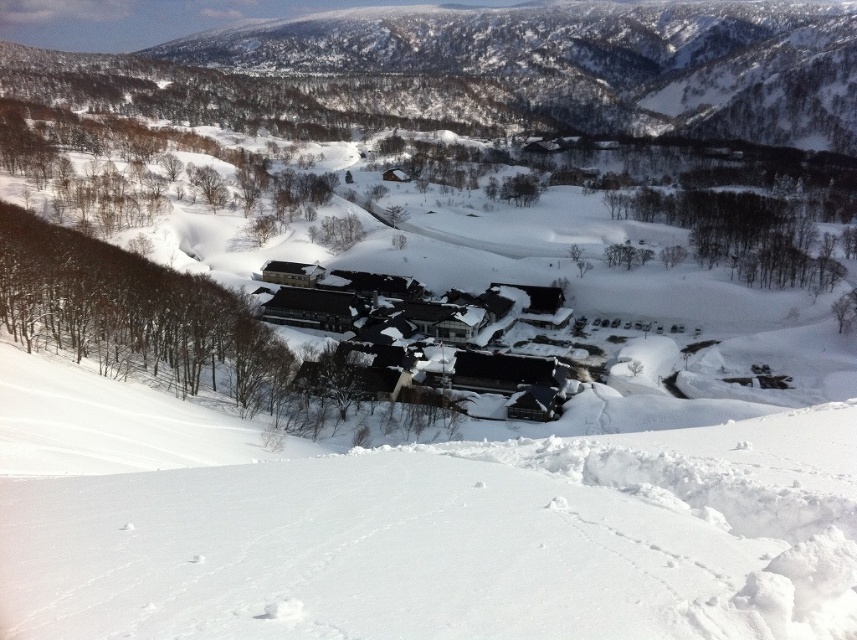
Question: Which point is farther to the camera?

Choices:
 (A) (370, 307)
 (B) (532, 552)

Answer: (A)

Question: Considering the relative positions of white snow at lower center and black shingled roofs at center in the image provided, where is white snow at lower center located with respect to black shingled roofs at center?

Choices:
 (A) above
 (B) below

Answer: (B)

Question: Among these points, which one is farthest from the camera?

Choices:
 (A) (558, 492)
 (B) (409, 349)

Answer: (B)

Question: Is white snow at lower center in front of black shingled roofs at center?

Choices:
 (A) no
 (B) yes

Answer: (B)

Question: Can you confirm if white snow at lower center is positioned to the left of black shingled roofs at center?

Choices:
 (A) no
 (B) yes

Answer: (A)